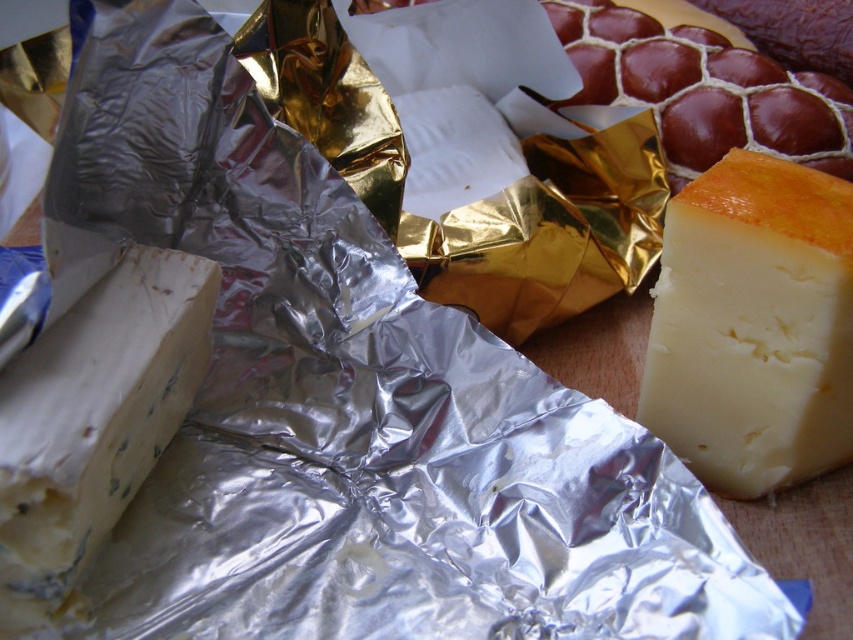
From the picture: Does yellow creamy cheese at right have a smaller size compared to blue veined cheese at lower left?

Actually, yellow creamy cheese at right might be larger than blue veined cheese at lower left.

Between point (791, 324) and point (15, 618), which one is positioned behind?

Point (791, 324)

Where is `yellow creamy cheese at right`? The height and width of the screenshot is (640, 853). yellow creamy cheese at right is located at coordinates point(753,326).